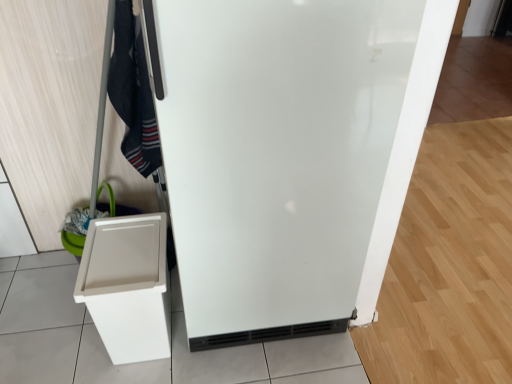
Where is `free spot to the left of white plastic bin at lower left`? The width and height of the screenshot is (512, 384). free spot to the left of white plastic bin at lower left is located at coordinates (62, 339).